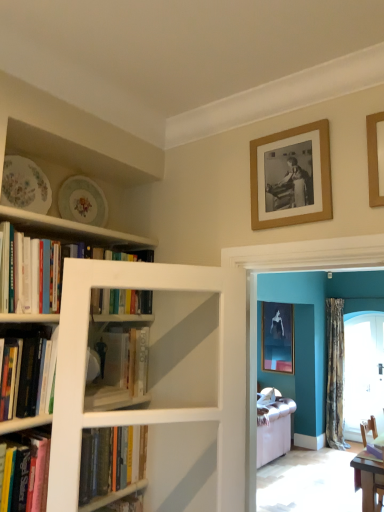
Question: Is point (329, 429) positioned closer to the camera than point (94, 484)?

Choices:
 (A) closer
 (B) farther

Answer: (B)

Question: In terms of size, does camouflage fabric curtain at right appear bigger or smaller than hardcover book at center, marked as the fifth book in a top-to-bottom arrangement?

Choices:
 (A) small
 (B) big

Answer: (B)

Question: Which object is the closest to the hardcover book at left, which is the second book from top to bottom?

Choices:
 (A) porcelain floral plate at upper left, marked as the second plate in a front-to-back arrangement
 (B) clear glass door at right
 (C) hardcover book at center, acting as the 3th book starting from the bottom
 (D) hardcover books at left, placed as the 1th book when sorted from top to bottom
 (E) camouflage fabric curtain at right

Answer: (C)

Question: Which object is positioned closest to the hardcover book at left, which is the second book from top to bottom?

Choices:
 (A) wooden picture frame at upper right, arranged as the 1th picture frame when viewed from the front
 (B) hardcover book at center, the first book positioned from the bottom
 (C) wooden chair at lower right
 (D) clear glass door at right
 (E) wooden framed photo at upper right, marked as the 2th picture frame in a front-to-back arrangement

Answer: (B)